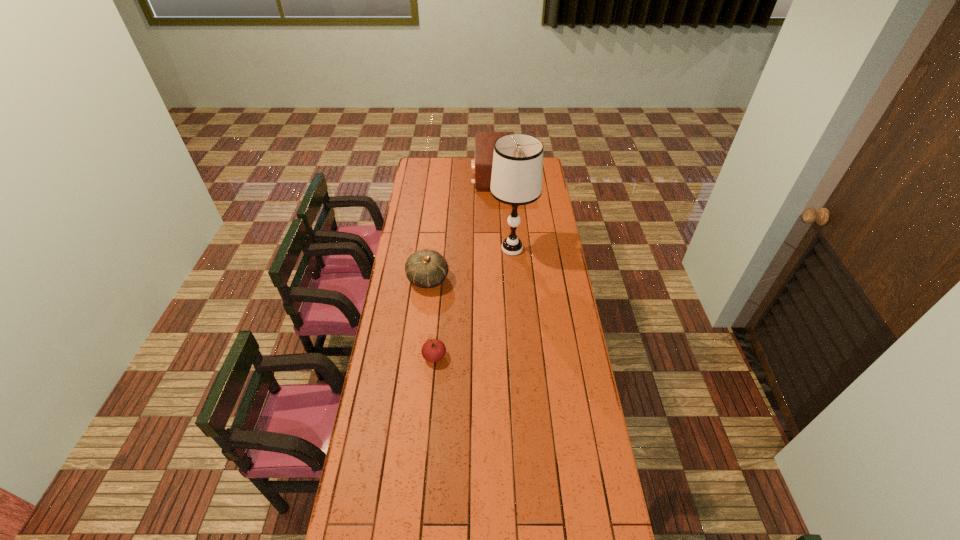
Find the location of a particular element. vacant space situated 0.320m on the front panel of the radio receiver is located at coordinates (420, 176).

What are the coordinates of `free space located 0.180m on the front panel of the radio receiver` in the screenshot? It's located at (444, 176).

The width and height of the screenshot is (960, 540). Find the location of `vacant space located 0.070m on the front of the gourd`. vacant space located 0.070m on the front of the gourd is located at coordinates (425, 306).

Where is `vacant space located 0.360m on the right of the shortest object`? The height and width of the screenshot is (540, 960). vacant space located 0.360m on the right of the shortest object is located at coordinates point(535,356).

What are the coordinates of `object that is at the far edge` in the screenshot? It's located at (481, 166).

I want to click on object located at the left edge, so click(427, 268).

Image resolution: width=960 pixels, height=540 pixels. Find the location of `object at the right edge`. object at the right edge is located at coordinates (517, 170).

Where is `vacant space at the left edge of the desktop`? vacant space at the left edge of the desktop is located at coordinates (377, 367).

This screenshot has width=960, height=540. Identify the location of free space at the right edge of the desktop. (565, 267).

Locate an element on the screen. vacant area at the far left corner of the desktop is located at coordinates (415, 165).